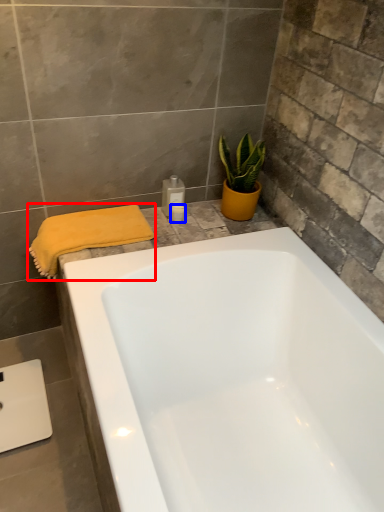
Question: Which object is further to the camera taking this photo, bath towel (highlighted by a red box) or toiletry (highlighted by a blue box)?

Choices:
 (A) bath towel
 (B) toiletry

Answer: (B)